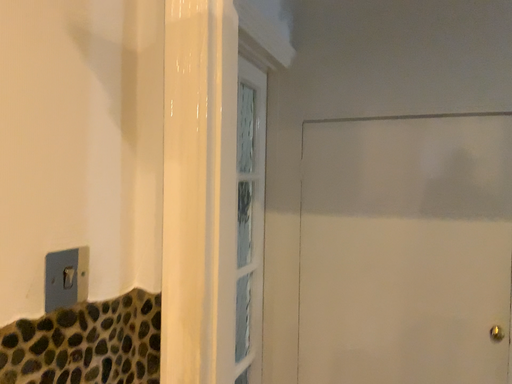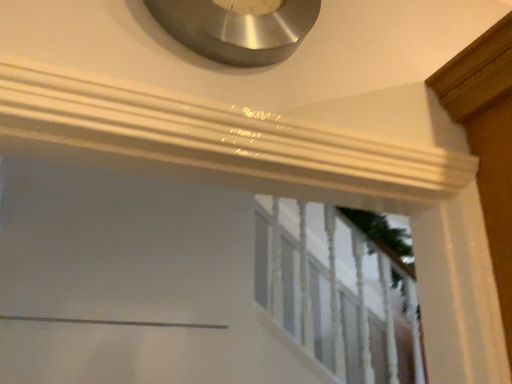
Question: Which way did the camera rotate in the video?

Choices:
 (A) rotated left
 (B) rotated right

Answer: (B)